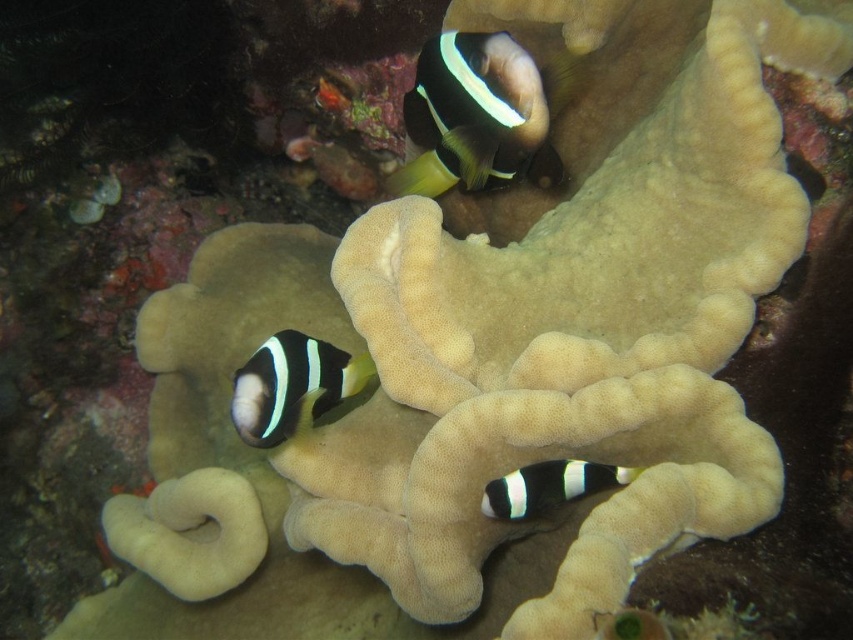
Question: Can you confirm if black and white striped fish at lower left is smaller than black matte clownfish at lower center?

Choices:
 (A) no
 (B) yes

Answer: (A)

Question: Is black matte clownfish at upper center smaller than black and white striped fish at lower left?

Choices:
 (A) no
 (B) yes

Answer: (A)

Question: Which point is closer to the camera?

Choices:
 (A) (463, 156)
 (B) (263, 403)
 (C) (589, 486)

Answer: (C)

Question: Which point is closer to the camera taking this photo?

Choices:
 (A) (310, 426)
 (B) (460, 116)

Answer: (A)

Question: Does black matte clownfish at upper center come in front of black matte clownfish at lower center?

Choices:
 (A) no
 (B) yes

Answer: (A)

Question: Which object is the farthest from the black matte clownfish at upper center?

Choices:
 (A) black matte clownfish at lower center
 (B) black and white striped fish at lower left

Answer: (A)